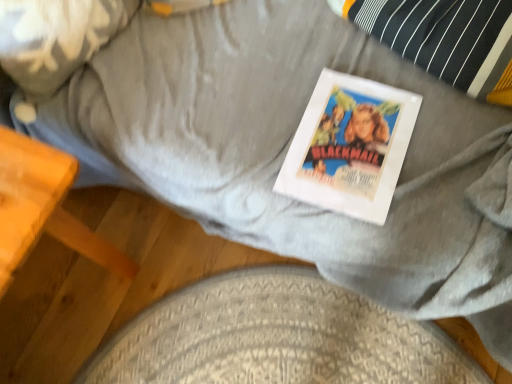
Question: Is fluffy white pillow at upper left completely or partially outside of textured gray dog bed at lower center?

Choices:
 (A) no
 (B) yes

Answer: (B)

Question: Does fluffy white pillow at upper left have a lesser width compared to textured gray dog bed at lower center?

Choices:
 (A) yes
 (B) no

Answer: (A)

Question: Is fluffy white pillow at upper left to the left of textured gray dog bed at lower center from the viewer's perspective?

Choices:
 (A) no
 (B) yes

Answer: (B)

Question: Is fluffy white pillow at upper left not near textured gray dog bed at lower center?

Choices:
 (A) yes
 (B) no

Answer: (B)

Question: Can you confirm if fluffy white pillow at upper left is positioned to the right of textured gray dog bed at lower center?

Choices:
 (A) no
 (B) yes

Answer: (A)

Question: Does fluffy white pillow at upper left come behind textured gray dog bed at lower center?

Choices:
 (A) no
 (B) yes

Answer: (A)

Question: Can you confirm if white paper at center is shorter than textured gray dog bed at lower center?

Choices:
 (A) no
 (B) yes

Answer: (A)

Question: Does white paper at center come behind textured gray dog bed at lower center?

Choices:
 (A) yes
 (B) no

Answer: (B)

Question: Does white paper at center appear on the left side of textured gray dog bed at lower center?

Choices:
 (A) yes
 (B) no

Answer: (B)

Question: From a real-world perspective, is white paper at center beneath textured gray dog bed at lower center?

Choices:
 (A) yes
 (B) no

Answer: (B)

Question: Is white paper at center not near textured gray dog bed at lower center?

Choices:
 (A) no
 (B) yes

Answer: (A)

Question: Can you confirm if white paper at center is taller than textured gray dog bed at lower center?

Choices:
 (A) no
 (B) yes

Answer: (B)

Question: Is wooden table at lower left a part of textured gray dog bed at lower center?

Choices:
 (A) yes
 (B) no

Answer: (B)